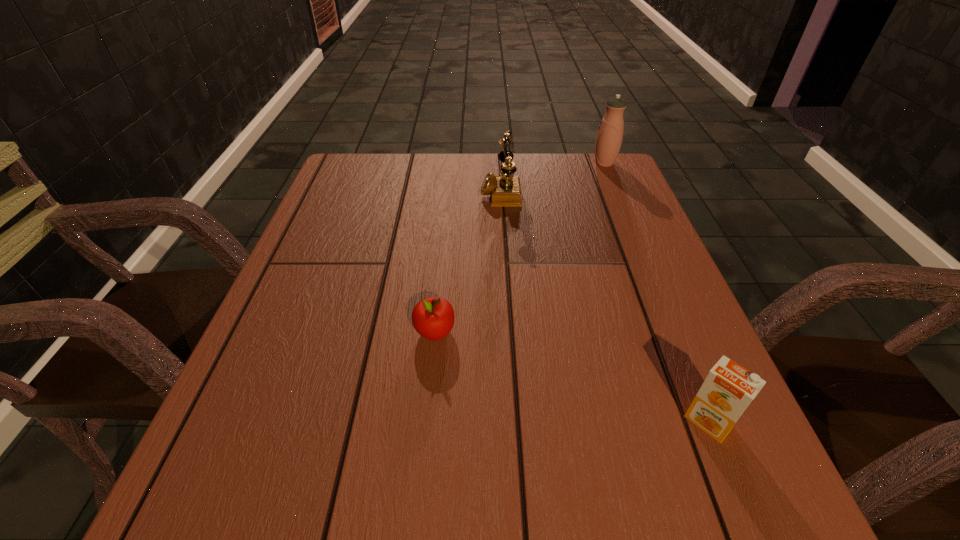
Find the location of a particular element. This screenshot has width=960, height=540. vacant space located on the dial number of the telephone is located at coordinates (427, 191).

Where is `vacant space located on the dial number of the telephone`? This screenshot has height=540, width=960. vacant space located on the dial number of the telephone is located at coordinates (439, 191).

Identify the location of vacant area situated on the back of the nearest object. This screenshot has width=960, height=540. [x=640, y=256].

At what (x,y) coordinates should I click in order to perform the action: click on vacant area situated on the right of the apple. Please return your answer as a coordinate pair (x, y). Looking at the image, I should click on (660, 332).

Locate an element on the screen. This screenshot has width=960, height=540. thermos bottle present at the far edge is located at coordinates (609, 138).

Locate an element on the screen. This screenshot has width=960, height=540. telephone at the far edge is located at coordinates (505, 191).

At what (x,y) coordinates should I click in order to perform the action: click on thermos bottle present at the right edge. Please return your answer as a coordinate pair (x, y). Image resolution: width=960 pixels, height=540 pixels. Looking at the image, I should click on (609, 138).

I want to click on orange juice that is at the right edge, so click(x=729, y=388).

This screenshot has width=960, height=540. What are the coordinates of `object that is at the far right corner` in the screenshot? It's located at (609, 138).

This screenshot has width=960, height=540. In order to click on vacant space at the far edge of the desktop in this screenshot , I will do `click(473, 174)`.